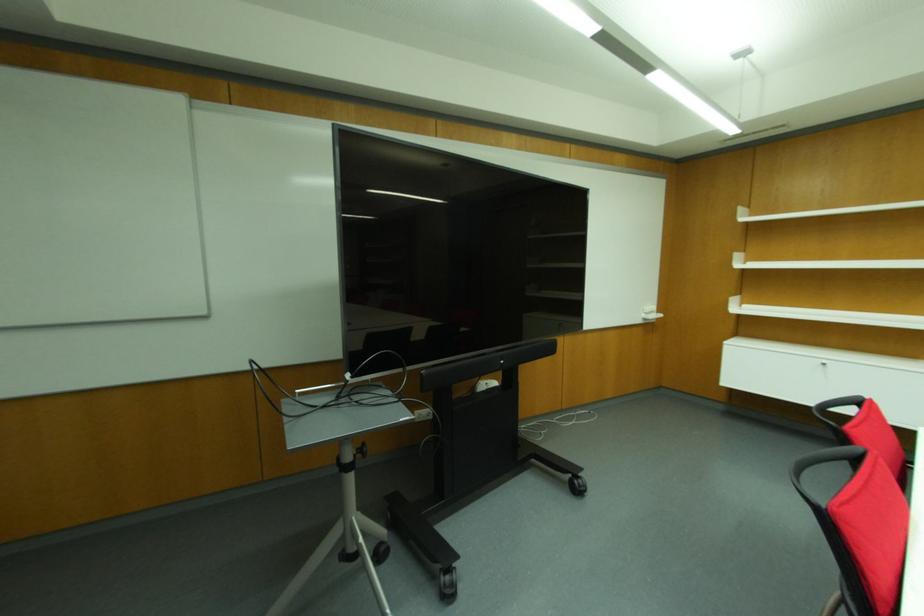
Where is `black adjustment knob`? The height and width of the screenshot is (616, 924). black adjustment knob is located at coordinates (361, 450).